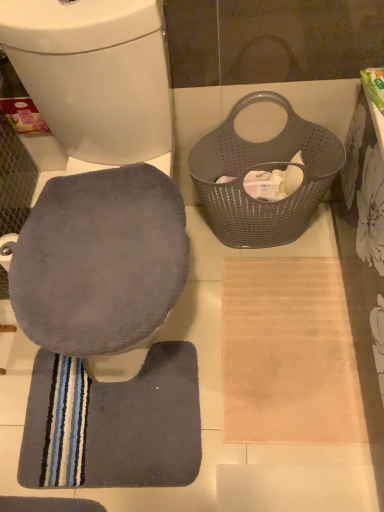
Question: From a real-world perspective, is gray fabric toilet seat at lower left physically above dark gray plush bath mat at lower left?

Choices:
 (A) no
 (B) yes

Answer: (B)

Question: Is gray fabric toilet seat at lower left not inside dark gray plush bath mat at lower left?

Choices:
 (A) yes
 (B) no

Answer: (A)

Question: Does gray fabric toilet seat at lower left have a greater width compared to dark gray plush bath mat at lower left?

Choices:
 (A) yes
 (B) no

Answer: (A)

Question: Does gray fabric toilet seat at lower left have a larger size compared to dark gray plush bath mat at lower left?

Choices:
 (A) yes
 (B) no

Answer: (A)

Question: Is dark gray plush bath mat at lower left inside gray fabric toilet seat at lower left?

Choices:
 (A) yes
 (B) no

Answer: (B)

Question: Is dark gray plush bath mat at lower left inside or outside of gray fabric toilet seat at lower left?

Choices:
 (A) inside
 (B) outside

Answer: (B)

Question: From a real-world perspective, is dark gray plush bath mat at lower left above or below gray fabric toilet seat at lower left?

Choices:
 (A) above
 (B) below

Answer: (B)

Question: From their relative heights in the image, would you say dark gray plush bath mat at lower left is taller or shorter than gray fabric toilet seat at lower left?

Choices:
 (A) tall
 (B) short

Answer: (B)

Question: Visually, is dark gray plush bath mat at lower left positioned to the left or to the right of gray fabric toilet seat at lower left?

Choices:
 (A) left
 (B) right

Answer: (B)

Question: Considering the positions of gray perforated laundry basket at upper right and dark gray plush bath mat at lower left in the image, is gray perforated laundry basket at upper right taller or shorter than dark gray plush bath mat at lower left?

Choices:
 (A) tall
 (B) short

Answer: (A)

Question: Considering the positions of gray perforated laundry basket at upper right and dark gray plush bath mat at lower left in the image, is gray perforated laundry basket at upper right bigger or smaller than dark gray plush bath mat at lower left?

Choices:
 (A) small
 (B) big

Answer: (B)

Question: Is gray perforated laundry basket at upper right situated inside dark gray plush bath mat at lower left or outside?

Choices:
 (A) outside
 (B) inside

Answer: (A)

Question: From the image's perspective, is gray perforated laundry basket at upper right positioned above or below dark gray plush bath mat at lower left?

Choices:
 (A) below
 (B) above

Answer: (B)

Question: Based on their sizes in the image, would you say dark gray plush bath mat at lower left is bigger or smaller than gray perforated laundry basket at upper right?

Choices:
 (A) big
 (B) small

Answer: (B)

Question: In the image, is dark gray plush bath mat at lower left on the left side or the right side of gray perforated laundry basket at upper right?

Choices:
 (A) left
 (B) right

Answer: (A)